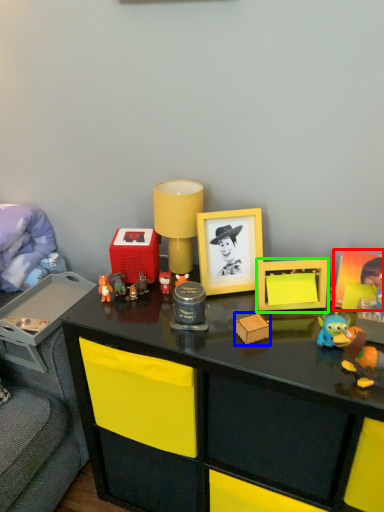
Question: Which is farther away from picture frame (highlighted by a red box)? toy (highlighted by a blue box) or toy (highlighted by a green box)?

Choices:
 (A) toy
 (B) toy

Answer: (A)